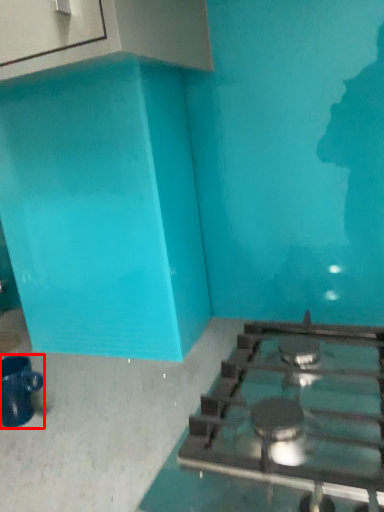
Question: Where is coffee cup (annotated by the red box) located in relation to gas stove in the image?

Choices:
 (A) right
 (B) left

Answer: (B)